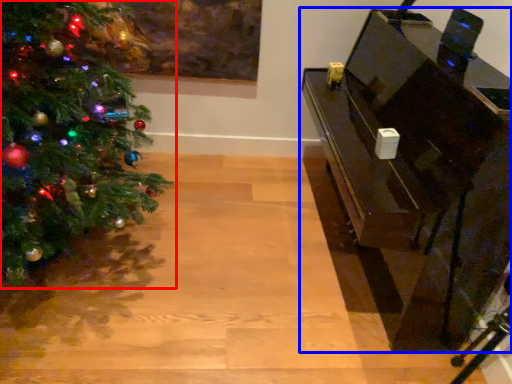
Question: Which object is further to the camera taking this photo, christmas tree (highlighted by a red box) or furniture (highlighted by a blue box)?

Choices:
 (A) christmas tree
 (B) furniture

Answer: (B)